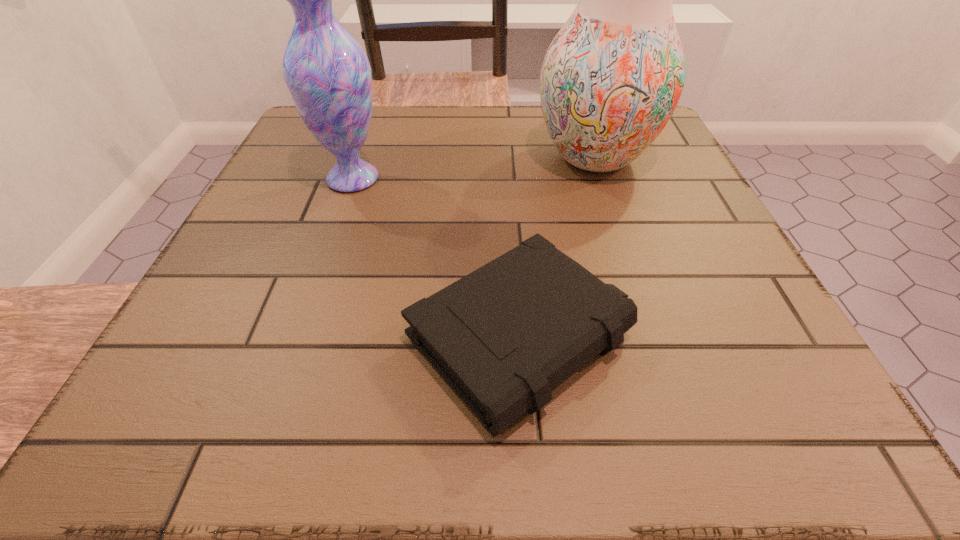
The image size is (960, 540). Find the location of `object that is at the right edge`. object that is at the right edge is located at coordinates (611, 79).

I want to click on object positioned at the far right corner, so click(611, 79).

Find the location of a particular element. The width and height of the screenshot is (960, 540). vacant space at the far edge of the desktop is located at coordinates (512, 119).

In the image, there is a desktop. At what (x,y) coordinates should I click in order to perform the action: click on free space at the near edge. Please return your answer as a coordinate pair (x, y). The height and width of the screenshot is (540, 960). Looking at the image, I should click on (603, 399).

The image size is (960, 540). I want to click on vacant space at the left edge of the desktop, so click(235, 249).

The width and height of the screenshot is (960, 540). In the image, there is a desktop. Find the location of `vacant space at the right edge`. vacant space at the right edge is located at coordinates (648, 225).

In the image, there is a desktop. Identify the location of blank space at the far left corner. The width and height of the screenshot is (960, 540). (298, 148).

Find the location of `unoccupied position between the right vase and the left vase`. unoccupied position between the right vase and the left vase is located at coordinates (473, 168).

This screenshot has height=540, width=960. In order to click on vacant area that lies between the right vase and the nearest object in this screenshot , I will do `click(558, 247)`.

Where is `free point between the leftmost object and the shortest object`? The height and width of the screenshot is (540, 960). free point between the leftmost object and the shortest object is located at coordinates (437, 258).